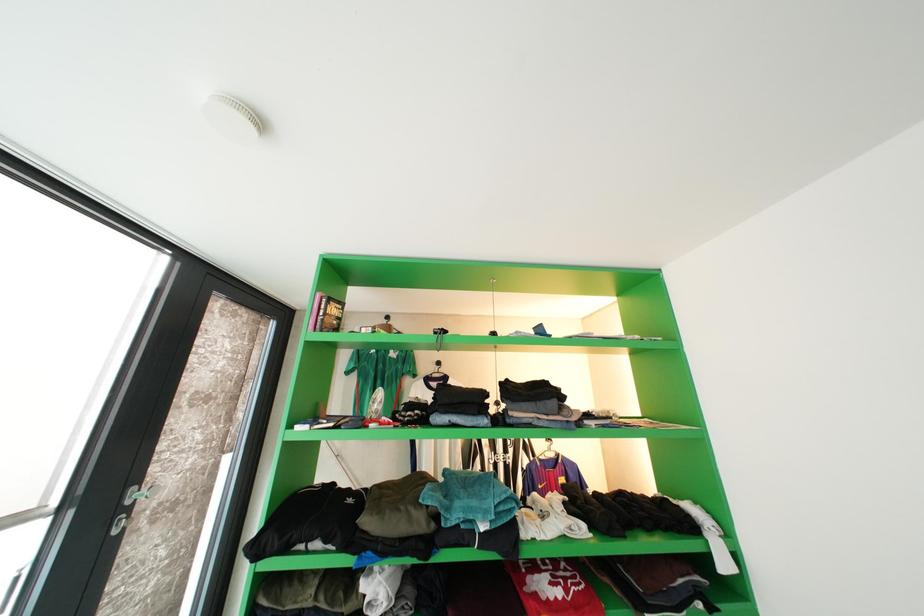
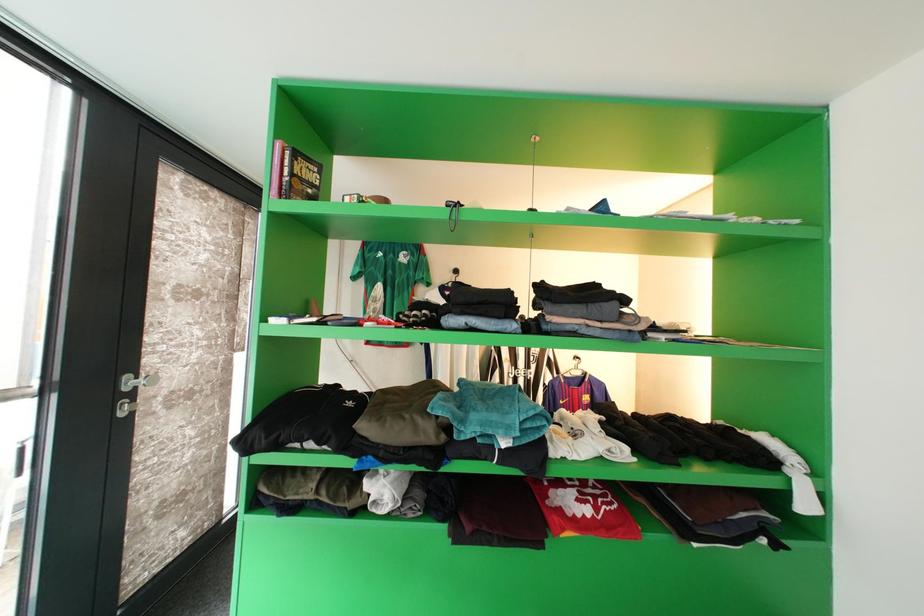
Question: The first image is from the beginning of the video and the second image is from the end. How did the camera likely rotate when shooting the video?

Choices:
 (A) Left
 (B) Right
 (C) Up
 (D) Down

Answer: (D)